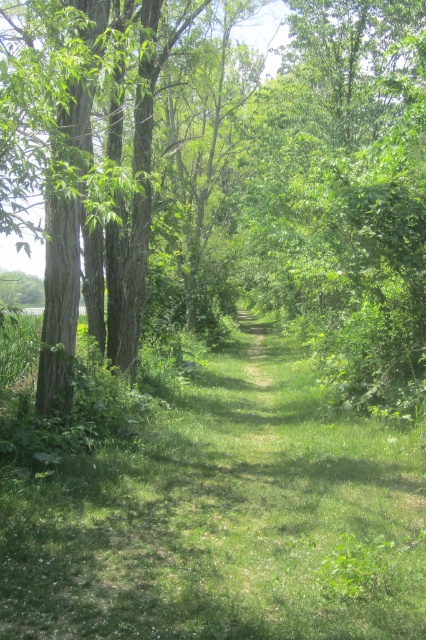
From the picture: Who is taller, green leafy tree at center or green grass at center?

green leafy tree at center is taller.

Is the position of green leafy tree at center less distant than that of green grass at center?

That is False.

Between point (311, 230) and point (173, 518), which one is positioned in front?

Point (173, 518) is more forward.

Find the location of a particular element. The width and height of the screenshot is (426, 640). green leafy tree at center is located at coordinates (276, 182).